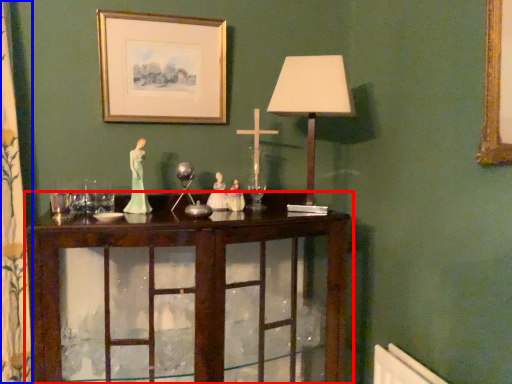
Question: Among these objects, which one is farthest to the camera, table (highlighted by a red box) or curtain (highlighted by a blue box)?

Choices:
 (A) table
 (B) curtain

Answer: (B)